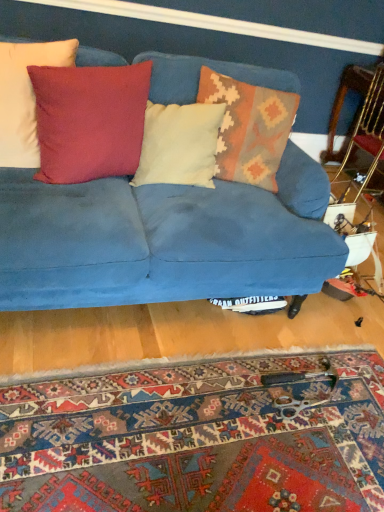
Where is `carpet with intricate patterns at lower center`? carpet with intricate patterns at lower center is located at coordinates (197, 438).

Describe the element at coordinates (25, 97) in the screenshot. I see `matte red pillow at upper left, which is counted as the first pillow, starting from the left` at that location.

Measure the distance between wooden armchair at right and camera.

wooden armchair at right is 2.52 meters away from camera.

In order to face velvet blue couch at center, should I rotate leftwards or rightwards?

Turn left approximately 3.406 degrees to face it.

Identify the location of carpet with intricate patterns at lower center. The height and width of the screenshot is (512, 384). click(197, 438).

Identify the location of armchair that is on the right side of matte red pillow at upper left, which is counted as the first pillow, starting from the left. (369, 127).

Is matte red pillow at upper left, which is counted as the first pillow, starting from the left, far from wooden armchair at right?

Yes, matte red pillow at upper left, which is counted as the first pillow, starting from the left, and wooden armchair at right are located far from each other.

Looking at this image, is matte red pillow at upper left, positioned as the fourth pillow in right-to-left order, aimed at wooden armchair at right?

No, matte red pillow at upper left, positioned as the fourth pillow in right-to-left order, does not turn towards wooden armchair at right.

Is point (155, 183) closer to camera compared to point (382, 85)?

Yes, point (155, 183) is closer to viewer.

Is light blue suede pillow at center, the second pillow viewed from the right, positioned far away from wooden armchair at right?

Yes, light blue suede pillow at center, the second pillow viewed from the right, is far from wooden armchair at right.

Where is `armchair above the light blue suede pillow at center, the second pillow viewed from the right (from the image's perspective)`? armchair above the light blue suede pillow at center, the second pillow viewed from the right (from the image's perspective) is located at coordinates (369, 127).

Measure the distance between light blue suede pillow at center, the second pillow viewed from the right, and wooden armchair at right.

They are 1.41 meters apart.

Does suede-like red pillow at upper left, placed as the third pillow when sorted from right to left, have a greater width compared to matte red pillow at upper left, positioned as the fourth pillow in right-to-left order?

Yes.

Based on their sizes in the image, would you say suede-like red pillow at upper left, the second pillow in the left-to-right sequence, is bigger or smaller than matte red pillow at upper left, which is counted as the first pillow, starting from the left?

Clearly, suede-like red pillow at upper left, the second pillow in the left-to-right sequence, is larger in size than matte red pillow at upper left, which is counted as the first pillow, starting from the left.

How many degrees apart are the facing directions of suede-like red pillow at upper left, the second pillow in the left-to-right sequence, and matte red pillow at upper left, which is counted as the first pillow, starting from the left?

The angle between the facing direction of suede-like red pillow at upper left, the second pillow in the left-to-right sequence, and the facing direction of matte red pillow at upper left, which is counted as the first pillow, starting from the left, is 4.31 degrees.

Which object is closer to the camera, velvet blue couch at center or matte red pillow at upper left, which is counted as the first pillow, starting from the left?

velvet blue couch at center is more forward.

From a real-world perspective, is velvet blue couch at center positioned under matte red pillow at upper left, which is counted as the first pillow, starting from the left, based on gravity?

Yes, from a real-world perspective, velvet blue couch at center is below matte red pillow at upper left, which is counted as the first pillow, starting from the left.

Does point (1, 277) come farther from viewer compared to point (27, 110)?

That is False.

From the image's perspective, does velvet blue couch at center appear higher than matte red pillow at upper left, positioned as the fourth pillow in right-to-left order?

No, from the image's perspective, velvet blue couch at center is not above matte red pillow at upper left, positioned as the fourth pillow in right-to-left order.

From a real-world perspective, who is located lower, wooden armchair at right or carpet with intricate patterns at lower center?

carpet with intricate patterns at lower center, from a real-world perspective.

Is wooden armchair at right smaller than carpet with intricate patterns at lower center?

No, wooden armchair at right is not smaller than carpet with intricate patterns at lower center.

Which is more to the right, wooden armchair at right or carpet with intricate patterns at lower center?

From the viewer's perspective, wooden armchair at right appears more on the right side.

From the picture: Is wooden armchair at right looking in the opposite direction of carpet with intricate patterns at lower center?

wooden armchair at right does not have its back to carpet with intricate patterns at lower center.

Is matte red pillow at upper left, positioned as the fourth pillow in right-to-left order, inside or outside of velvet blue couch at center?

The correct answer is: inside.

Consider the image. From the image's perspective, which is below, matte red pillow at upper left, which is counted as the first pillow, starting from the left, or velvet blue couch at center?

From the image's view, velvet blue couch at center is below.

Starting from the velvet blue couch at center, which pillow is the 2nd one behind? Please provide its 2D coordinates.

[(25, 97)]

Are suede-like red pillow at upper left, the second pillow in the left-to-right sequence, and carpet with intricate patterns at lower center far apart?

No, suede-like red pillow at upper left, the second pillow in the left-to-right sequence, is not far away from carpet with intricate patterns at lower center.

From the image's perspective, would you say suede-like red pillow at upper left, the second pillow in the left-to-right sequence, is shown under carpet with intricate patterns at lower center?

No, from the image's perspective, suede-like red pillow at upper left, the second pillow in the left-to-right sequence, is not below carpet with intricate patterns at lower center.

Considering the points (105, 113) and (362, 430), which point is behind, point (105, 113) or point (362, 430)?

The point (105, 113) is behind.

The image size is (384, 512). What are the coordinates of `the 3rd pillow in front of the wooden armchair at right` in the screenshot? It's located at (25, 97).

Which pillow is the 2nd one when counting from the left side of the wooden armchair at right? Please provide its 2D coordinates.

[(179, 144)]

Consider the image. From the image, which object appears to be farther from carpet with intricate patterns at lower center, suede-like red pillow at upper left, the second pillow in the left-to-right sequence, or velvet blue couch at center?

The object further to carpet with intricate patterns at lower center is suede-like red pillow at upper left, the second pillow in the left-to-right sequence.

Which object lies further to the anchor point carpet with intricate patterns at lower center, matte red pillow at upper left, which is counted as the first pillow, starting from the left, or light blue suede pillow at center, which is the 3th pillow in left-to-right order?

Among the two, matte red pillow at upper left, which is counted as the first pillow, starting from the left, is located further to carpet with intricate patterns at lower center.

Estimate the real-world distances between objects in this image. Which object is closer to wooden armchair at right, knitted wool pillow at center, the 1th pillow viewed from the right, or velvet blue couch at center?

knitted wool pillow at center, the 1th pillow viewed from the right, is positioned closer to the anchor wooden armchair at right.

Which object lies further to the anchor point carpet with intricate patterns at lower center, light blue suede pillow at center, the second pillow viewed from the right, or matte red pillow at upper left, positioned as the fourth pillow in right-to-left order?

matte red pillow at upper left, positioned as the fourth pillow in right-to-left order.

When comparing their distances from wooden armchair at right, does matte red pillow at upper left, positioned as the fourth pillow in right-to-left order, or suede-like red pillow at upper left, the second pillow in the left-to-right sequence, seem further?

Based on the image, matte red pillow at upper left, positioned as the fourth pillow in right-to-left order, appears to be further to wooden armchair at right.

When comparing their distances from suede-like red pillow at upper left, the second pillow in the left-to-right sequence, does light blue suede pillow at center, which is the 3th pillow in left-to-right order, or knitted wool pillow at center, which ranks as the fourth pillow in left-to-right order, seem further?

knitted wool pillow at center, which ranks as the fourth pillow in left-to-right order, lies further to suede-like red pillow at upper left, the second pillow in the left-to-right sequence, than the other object.

Looking at the image, which one is located closer to matte red pillow at upper left, which is counted as the first pillow, starting from the left, knitted wool pillow at center, which ranks as the fourth pillow in left-to-right order, or carpet with intricate patterns at lower center?

knitted wool pillow at center, which ranks as the fourth pillow in left-to-right order, is closer to matte red pillow at upper left, which is counted as the first pillow, starting from the left.

Considering their positions, is suede-like red pillow at upper left, the second pillow in the left-to-right sequence, positioned closer to matte red pillow at upper left, which is counted as the first pillow, starting from the left, than carpet with intricate patterns at lower center?

suede-like red pillow at upper left, the second pillow in the left-to-right sequence.

Find the location of `pillow between suede-like red pillow at upper left, placed as the third pillow when sorted from right to left, and knitted wool pillow at center, which ranks as the fourth pillow in left-to-right order`. pillow between suede-like red pillow at upper left, placed as the third pillow when sorted from right to left, and knitted wool pillow at center, which ranks as the fourth pillow in left-to-right order is located at coordinates (179, 144).

This screenshot has height=512, width=384. I want to click on studio couch between matte red pillow at upper left, which is counted as the first pillow, starting from the left, and carpet with intricate patterns at lower center, in the vertical direction, so click(164, 239).

Find the location of a particular element. This screenshot has width=384, height=512. studio couch between light blue suede pillow at center, which is the 3th pillow in left-to-right order, and carpet with intricate patterns at lower center in the up-down direction is located at coordinates (164, 239).

This screenshot has height=512, width=384. Find the location of `pillow between light blue suede pillow at center, which is the 3th pillow in left-to-right order, and wooden armchair at right, in the horizontal direction`. pillow between light blue suede pillow at center, which is the 3th pillow in left-to-right order, and wooden armchair at right, in the horizontal direction is located at coordinates (249, 128).